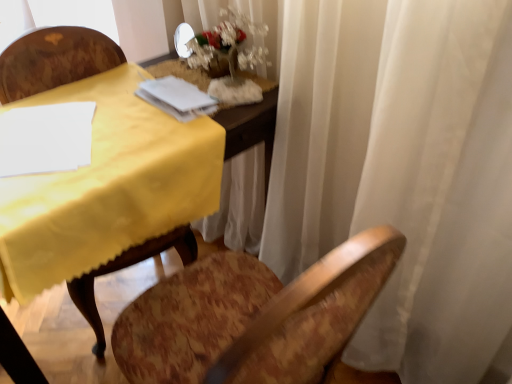
Locate an element on the screen. The height and width of the screenshot is (384, 512). vacant space to the right of white paper at upper center is located at coordinates (240, 104).